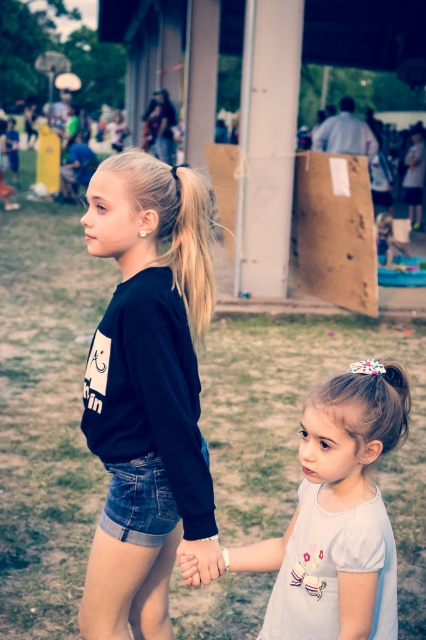
Question: Among these points, which one is nearest to the camera?

Choices:
 (A) (138, 621)
 (B) (207, 566)

Answer: (B)

Question: Can you confirm if matte black dress at upper center is smaller than smooth skin hand at center?

Choices:
 (A) no
 (B) yes

Answer: (A)

Question: Which object appears farthest from the camera in this image?

Choices:
 (A) matte black dress at upper center
 (B) black matte sweatshirt at center

Answer: (A)

Question: Can you confirm if black matte sweatshirt at center is wider than blonde hair at upper center?

Choices:
 (A) yes
 (B) no

Answer: (A)

Question: Estimate the real-world distances between objects in this image. Which object is closer to the blonde hair at upper center?

Choices:
 (A) white matte dress at lower right
 (B) matte black dress at upper center
 (C) smooth skin hand at center

Answer: (A)

Question: Observing the image, what is the correct spatial positioning of matte black dress at upper center in reference to smooth skin hand at center?

Choices:
 (A) below
 (B) above

Answer: (B)